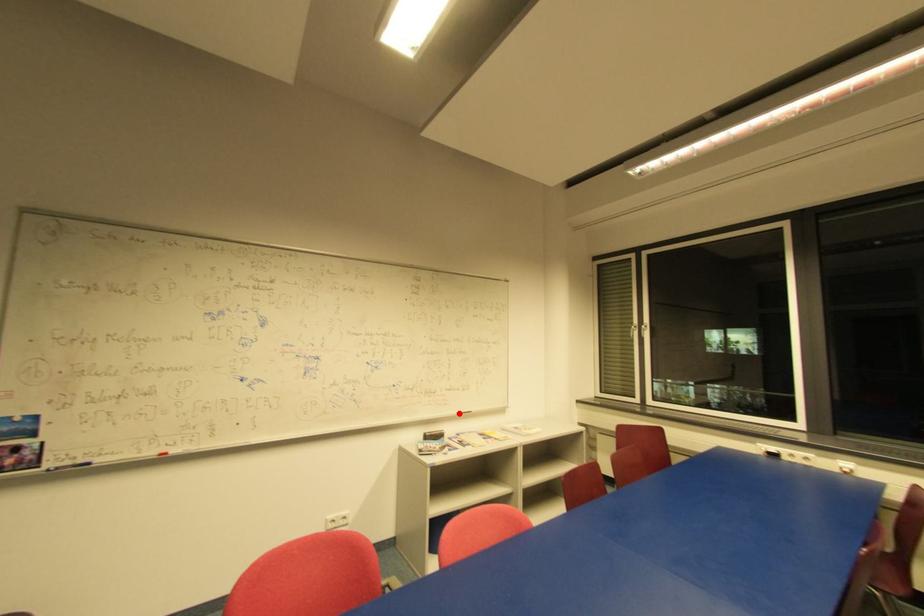
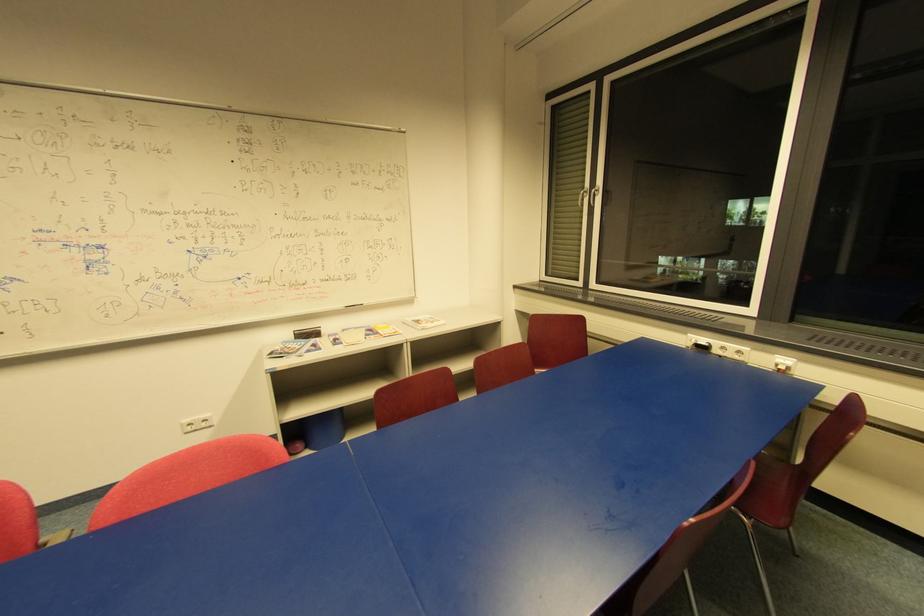
In the second image, find the point that corresponds to the highlighted location in the first image.

(344, 307)